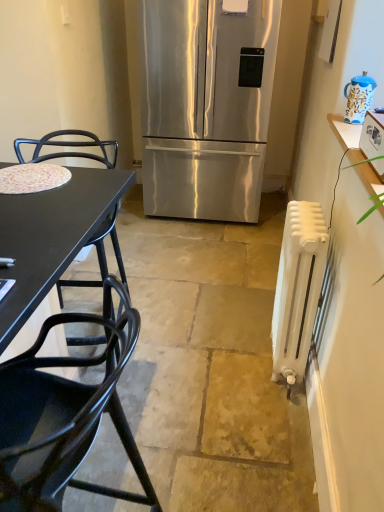
Question: Based on their positions, is white plastic toaster at upper right located to the left or right of blue and white ceramic teapot at upper right?

Choices:
 (A) left
 (B) right

Answer: (A)

Question: Is white plastic toaster at upper right bigger or smaller than blue and white ceramic teapot at upper right?

Choices:
 (A) small
 (B) big

Answer: (B)

Question: Which of these objects is positioned farthest from the black matte chair at lower left, which is counted as the 2th chair, starting from the back?

Choices:
 (A) white matte radiator at right
 (B) blue and white ceramic teapot at upper right
 (C) white plastic toaster at upper right
 (D) black metal chair at left, the first chair positioned from the back
 (E) stainless steel refrigerator at center

Answer: (E)

Question: Which object is positioned farthest from the black matte chair at lower left, which is counted as the 2th chair, starting from the back?

Choices:
 (A) blue and white ceramic teapot at upper right
 (B) white matte radiator at right
 (C) white plastic toaster at upper right
 (D) black metal chair at left, the first chair positioned from the back
 (E) stainless steel refrigerator at center

Answer: (E)